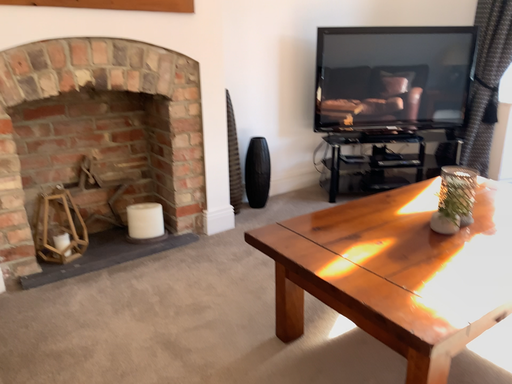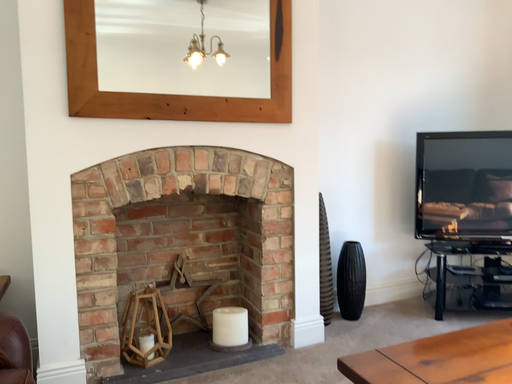
Question: Which way did the camera rotate in the video?

Choices:
 (A) rotated upward
 (B) rotated downward

Answer: (A)